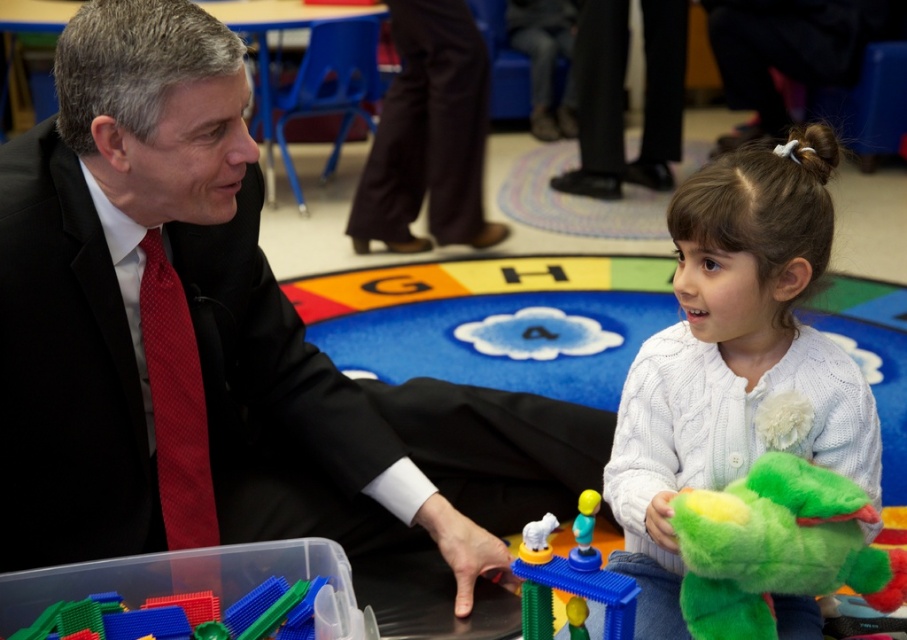
Which is in front, point (61, 365) or point (54, 620)?

Point (54, 620)

The image size is (907, 640). What do you see at coordinates (216, 344) in the screenshot?
I see `smooth black suit at center` at bounding box center [216, 344].

Who is more distant from viewer, (379, 502) or (125, 616)?

Positioned behind is point (379, 502).

Locate an element on the screen. smooth black suit at center is located at coordinates (216, 344).

Which of these two, white knitted sweater at center or black smooth pants at center, stands taller?

black smooth pants at center is taller.

Where is `white knitted sweater at center`? This screenshot has width=907, height=640. white knitted sweater at center is located at coordinates (735, 358).

Who is more forward, (827, 499) or (574, 604)?

Point (827, 499)

Does point (763, 582) come farther from viewer compared to point (571, 586)?

No.

From the picture: Who is more distant from viewer, (x=756, y=566) or (x=611, y=580)?

Positioned behind is point (x=611, y=580).

You are a GUI agent. You are given a task and a screenshot of the screen. Output one action in this format:
    pyautogui.click(x=<x>, y=<y>)
    Task: Click on the fluffy green plush toy at lower right
    
    Given the screenshot: What is the action you would take?
    pyautogui.click(x=777, y=547)